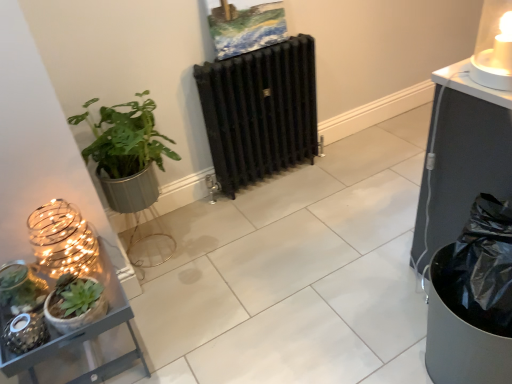
Find the location of `vacant area that is situated to the right of green matte plant at left, the 1th houseplant when ordered from back to front`. vacant area that is situated to the right of green matte plant at left, the 1th houseplant when ordered from back to front is located at coordinates (230, 236).